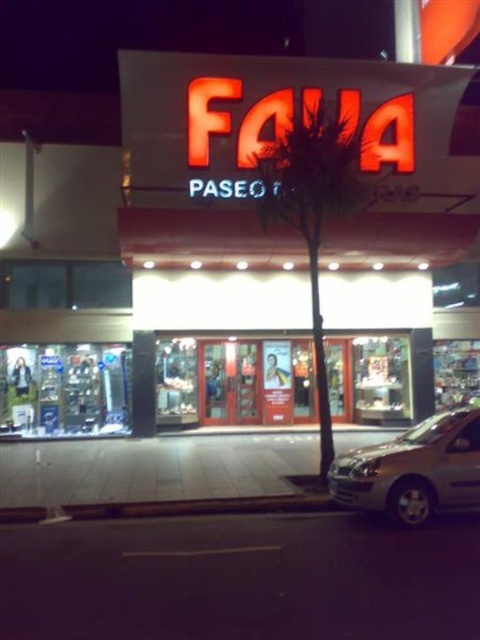
Does glass door entrance at center appear on the left side of silver metallic car at lower right?

Indeed, glass door entrance at center is positioned on the left side of silver metallic car at lower right.

Is glass door entrance at center shorter than silver metallic car at lower right?

Yes, glass door entrance at center is shorter than silver metallic car at lower right.

The height and width of the screenshot is (640, 480). Describe the element at coordinates (236, 381) in the screenshot. I see `glass door entrance at center` at that location.

Identify the location of glass door entrance at center. Image resolution: width=480 pixels, height=640 pixels. pos(236,381).